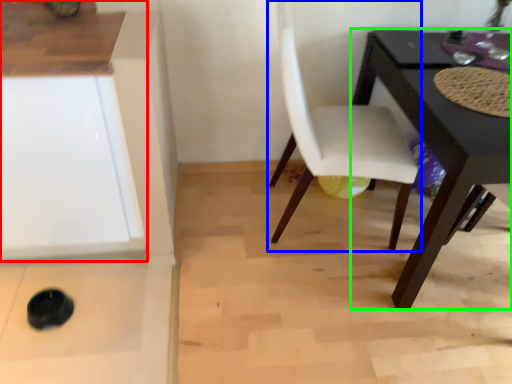
Question: Which object is the farthest from cabinetry (highlighted by a red box)? Choose among these: chair (highlighted by a blue box) or table (highlighted by a green box).

Choices:
 (A) chair
 (B) table

Answer: (B)